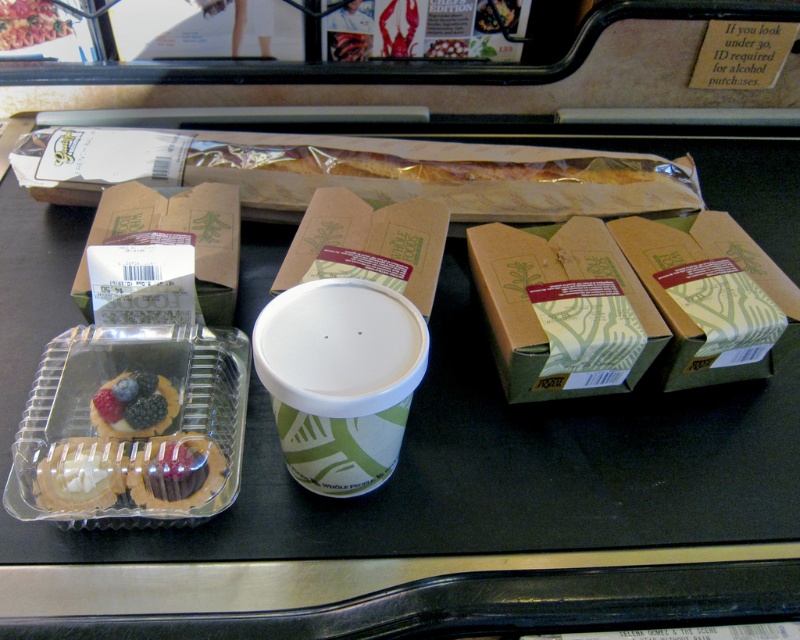
Is green cardboard box at center taller than chocolate frosted cupcake at lower left?

Indeed, green cardboard box at center has a greater height compared to chocolate frosted cupcake at lower left.

Which is in front, point (289, 268) or point (198, 497)?

Positioned in front is point (198, 497).

Image resolution: width=800 pixels, height=640 pixels. I want to click on green cardboard box at center, so click(x=372, y=237).

Does green paper cup at center come in front of matte plastic tartlet at center-left?

Yes, green paper cup at center is closer to the viewer.

Based on the photo, is green paper cup at center wider than matte plastic tartlet at center-left?

Correct, the width of green paper cup at center exceeds that of matte plastic tartlet at center-left.

Which is in front, point (409, 308) or point (100, 433)?

Point (409, 308) is in front.

Locate an element on the screen. The width and height of the screenshot is (800, 640). green paper cup at center is located at coordinates (340, 380).

In the scene shown: Is brown cardboard box at right to the right of green cardboard box at center from the viewer's perspective?

Yes, brown cardboard box at right is to the right of green cardboard box at center.

Consider the image. Which of these two, brown cardboard box at right or green cardboard box at center, stands shorter?

green cardboard box at center is shorter.

What do you see at coordinates (712, 298) in the screenshot? I see `brown cardboard box at right` at bounding box center [712, 298].

Where is `brown cardboard box at right`? brown cardboard box at right is located at coordinates (712, 298).